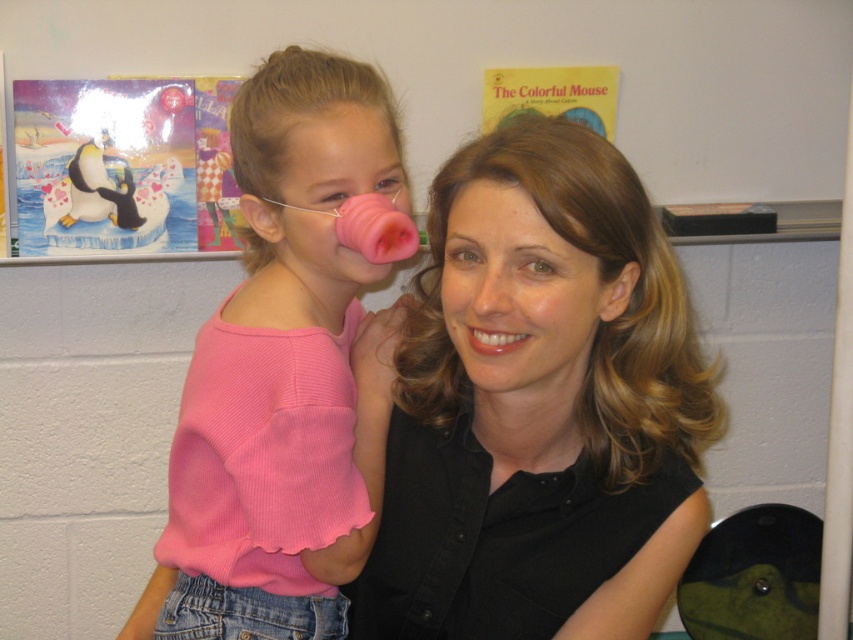
Is black matte shirt at center to the right of pink ribbed sweater at center from the viewer's perspective?

Correct, you'll find black matte shirt at center to the right of pink ribbed sweater at center.

Between point (500, 390) and point (325, 188), which one is positioned in front?

Point (500, 390) is more forward.

This screenshot has height=640, width=853. Find the location of `black matte shirt at center`. black matte shirt at center is located at coordinates (534, 396).

You are a GUI agent. You are given a task and a screenshot of the screen. Output one action in this format:
    pyautogui.click(x=<x>, y=<y>)
    Task: Click on the black matte shirt at center
    The height and width of the screenshot is (640, 853).
    Given the screenshot: What is the action you would take?
    pyautogui.click(x=534, y=396)

Who is positioned more to the right, black matte shirt at center or white matte penguin at upper left?

From the viewer's perspective, black matte shirt at center appears more on the right side.

Is point (415, 401) positioned after point (115, 209)?

No, (415, 401) is closer to viewer.

The width and height of the screenshot is (853, 640). What are the coordinates of `black matte shirt at center` in the screenshot? It's located at (534, 396).

Can you confirm if pink ribbed sweater at center is positioned to the left of white matte penguin at upper left?

No, pink ribbed sweater at center is not to the left of white matte penguin at upper left.

Is pink ribbed sweater at center shorter than white matte penguin at upper left?

No, pink ribbed sweater at center is not shorter than white matte penguin at upper left.

Based on the photo, measure the distance between point (242, 148) and camera.

They are 36.56 inches apart.

At what (x,y) coordinates should I click in order to perform the action: click on pink ribbed sweater at center. Please return your answer as a coordinate pair (x, y). The image size is (853, 640). Looking at the image, I should click on (286, 369).